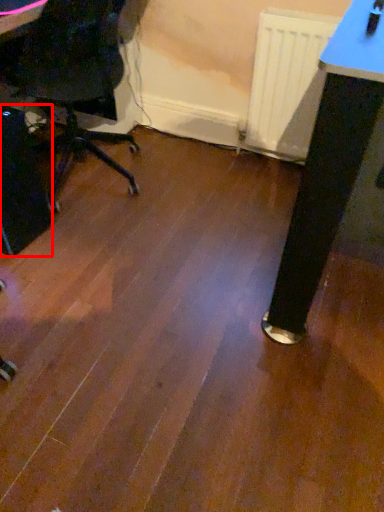
Question: Considering the relative positions of computer tower (annotated by the red box) and radiator in the image provided, where is computer tower (annotated by the red box) located with respect to the staircase?

Choices:
 (A) right
 (B) left

Answer: (B)